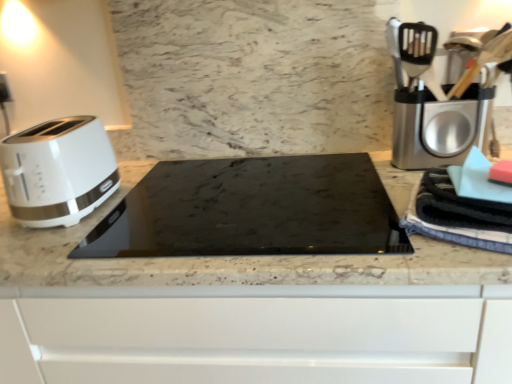
In order to click on free point above blue striped towel at right (from a real-world perspective) in this screenshot , I will do `click(473, 182)`.